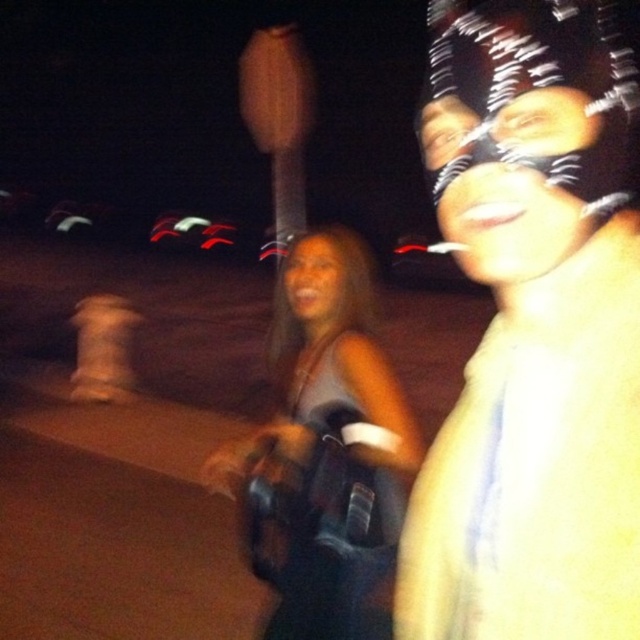
Is shiny metallic face mask at center to the right of matte black mask at upper right from the viewer's perspective?

Correct, you'll find shiny metallic face mask at center to the right of matte black mask at upper right.

Is shiny metallic face mask at center wider than matte black mask at upper right?

Yes, shiny metallic face mask at center is wider than matte black mask at upper right.

Does point (628, 84) come in front of point (452, 115)?

Yes, it is.

Where is `shiny metallic face mask at center`? shiny metallic face mask at center is located at coordinates (532, 328).

Can you confirm if matte black mask at upper right is smaller than matte skin tone face at center?

Yes.

Consider the image. Between matte black mask at upper right and matte skin tone face at center, which one appears on the left side from the viewer's perspective?

matte skin tone face at center

I want to click on matte black mask at upper right, so click(x=509, y=221).

Where is `matte black mask at upper right`? This screenshot has height=640, width=640. matte black mask at upper right is located at coordinates (509, 221).

Does shiny metallic face mask at center appear on the right side of matte skin tone face at center?

Indeed, shiny metallic face mask at center is positioned on the right side of matte skin tone face at center.

Find the location of a particular element. The width and height of the screenshot is (640, 640). shiny metallic face mask at center is located at coordinates (532, 328).